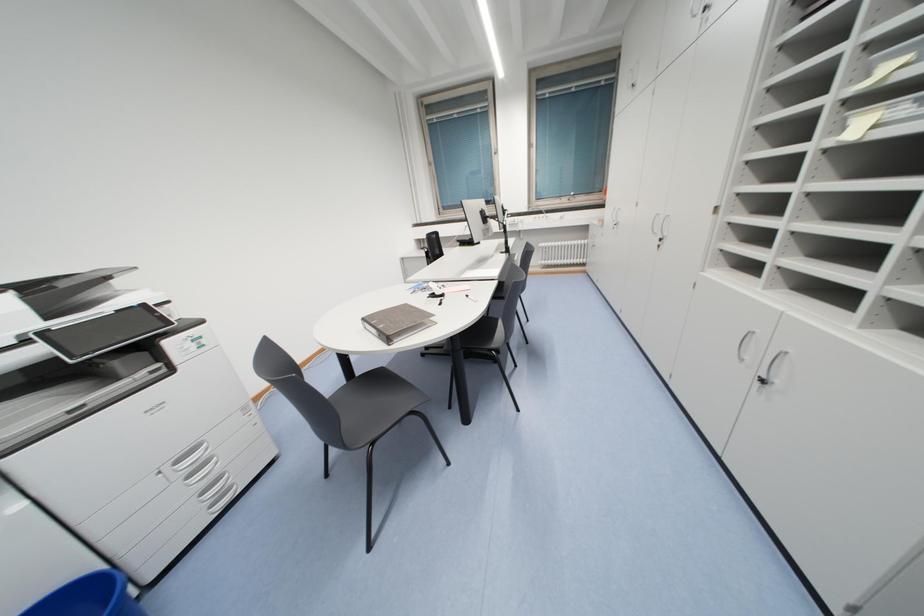
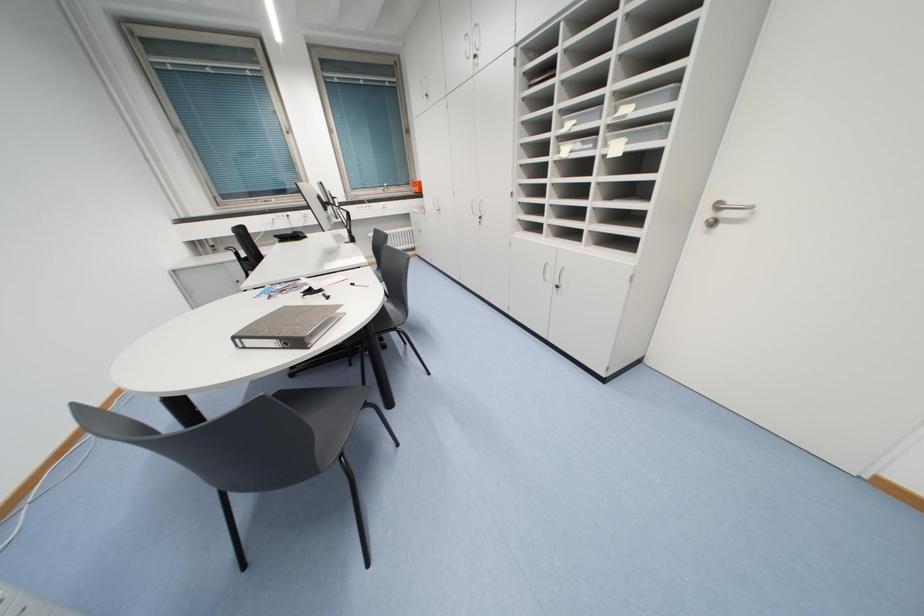
Question: The camera is either moving clockwise (left) or counter-clockwise (right) around the object. The first image is from the beginning of the video and the second image is from the end. Is the camera moving left or right when shooting the video?

Choices:
 (A) Left
 (B) Right

Answer: (A)